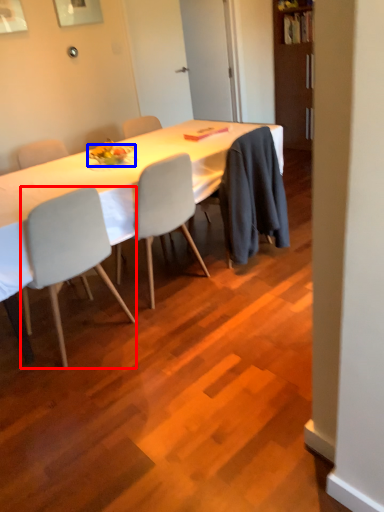
Question: Among these objects, which one is farthest to the camera, chair (highlighted by a red box) or plate (highlighted by a blue box)?

Choices:
 (A) chair
 (B) plate

Answer: (B)